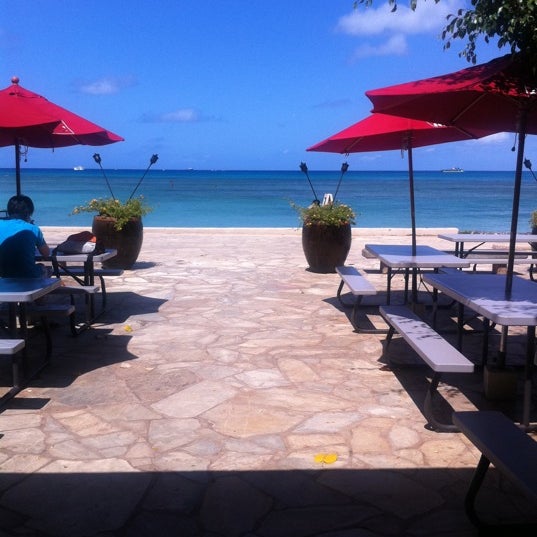
Where is `pot`? This screenshot has width=537, height=537. pot is located at coordinates (323, 245), (121, 229).